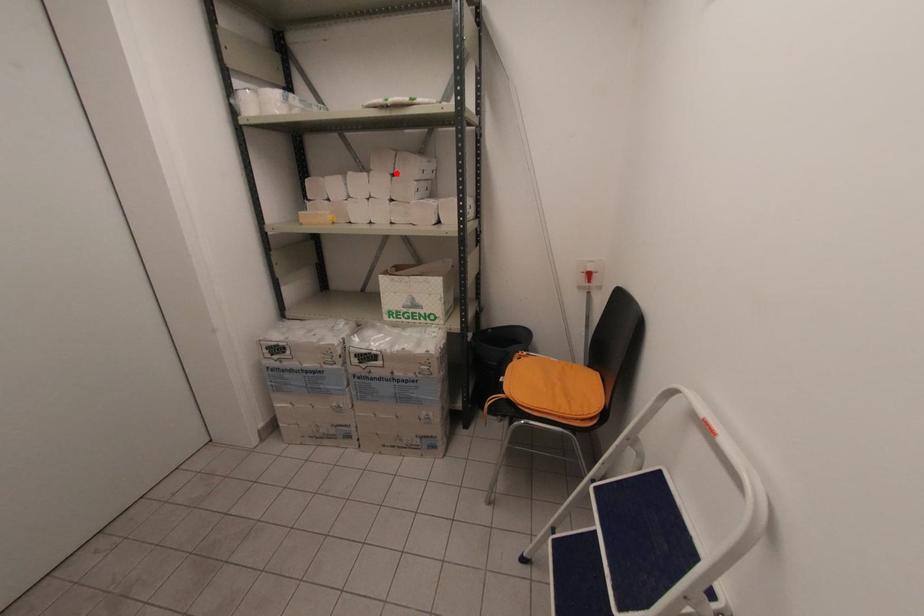
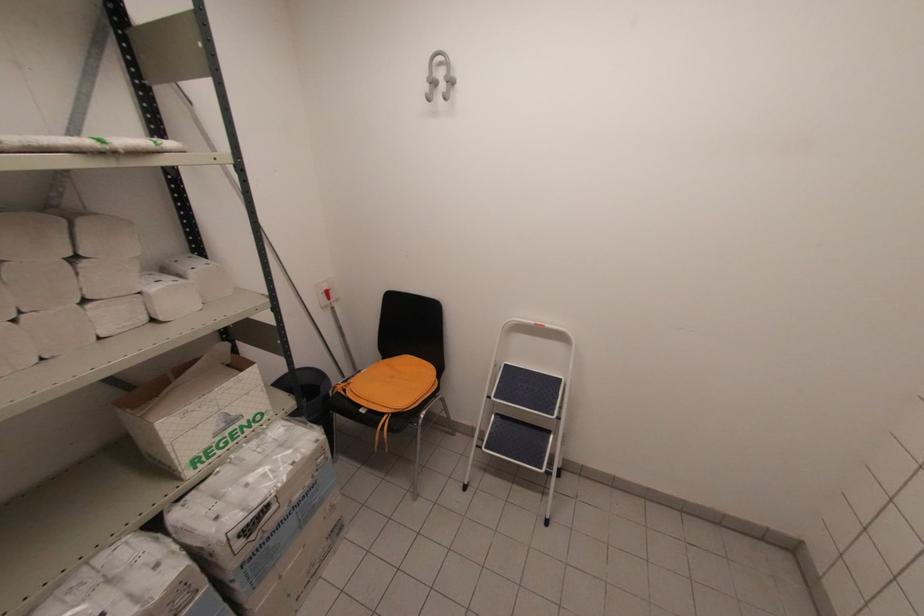
In the second image, find the point that corresponds to the highlighted location in the first image.

(81, 254)